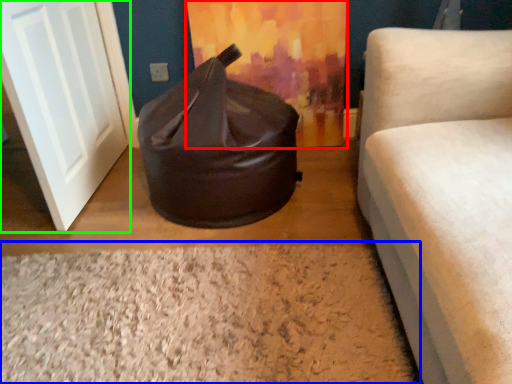
Question: Estimate the real-world distances between objects in this image. Which object is farther from curtain (highlighted by a red box), granite (highlighted by a blue box) or door (highlighted by a green box)?

Choices:
 (A) granite
 (B) door

Answer: (A)